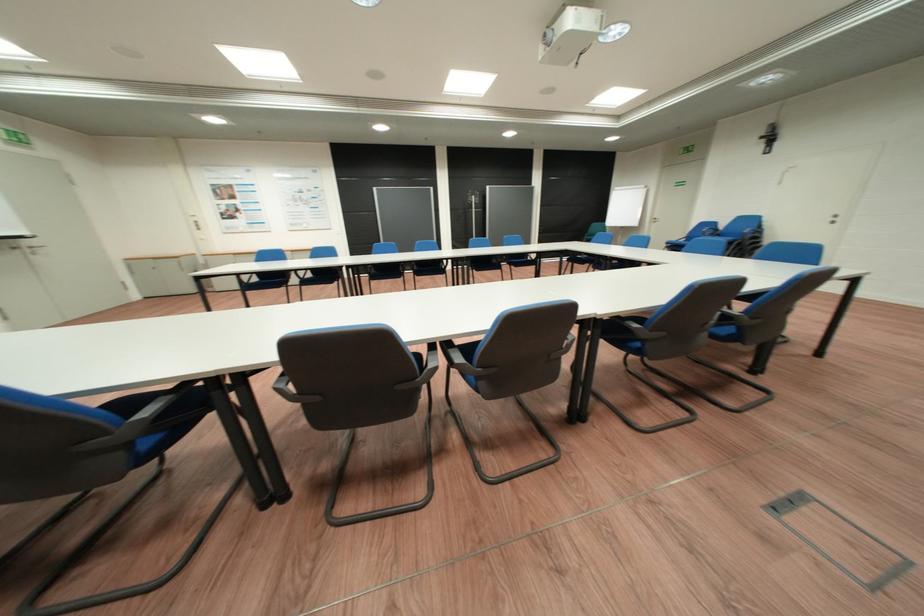
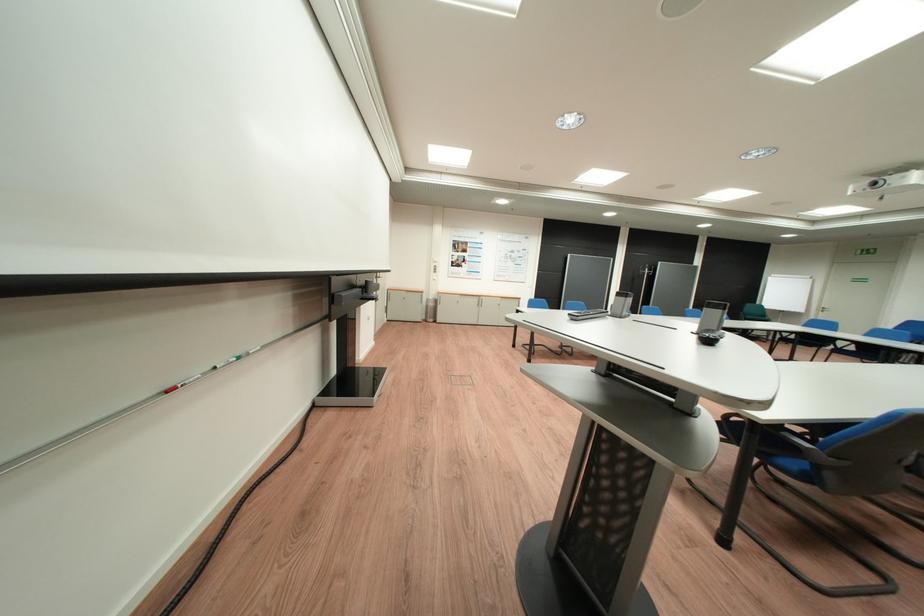
Question: I am providing you with two images of the same scene from different viewpoints. Please identify which objects are invisible in image2.

Choices:
 (A) white door handle
 (B) blue chair sitting surface
 (C) blue strap
 (D) black remote control

Answer: (B)